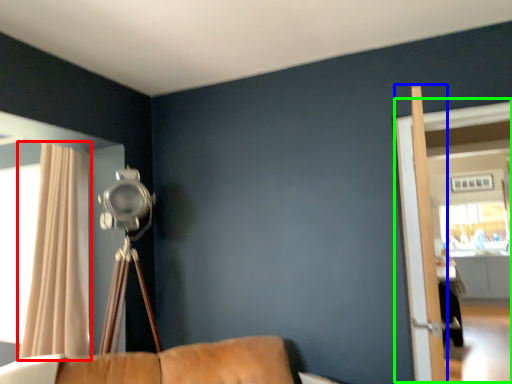
Question: Considering the real-world distances, which object is farthest from curtain (highlighted by a red box)? screen door (highlighted by a blue box) or screen door (highlighted by a green box)?

Choices:
 (A) screen door
 (B) screen door

Answer: (B)